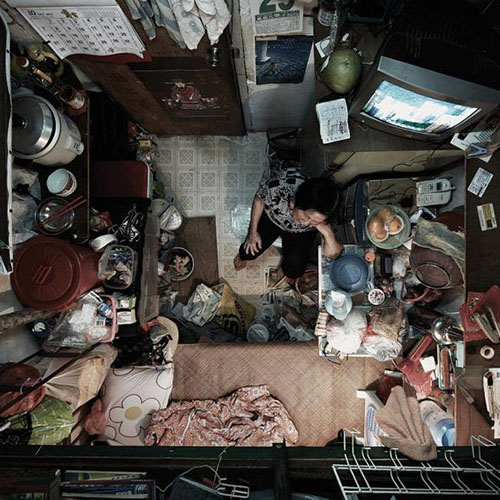
In order to click on electric cord in this screenshot , I will do pos(419,161), pos(394,166).